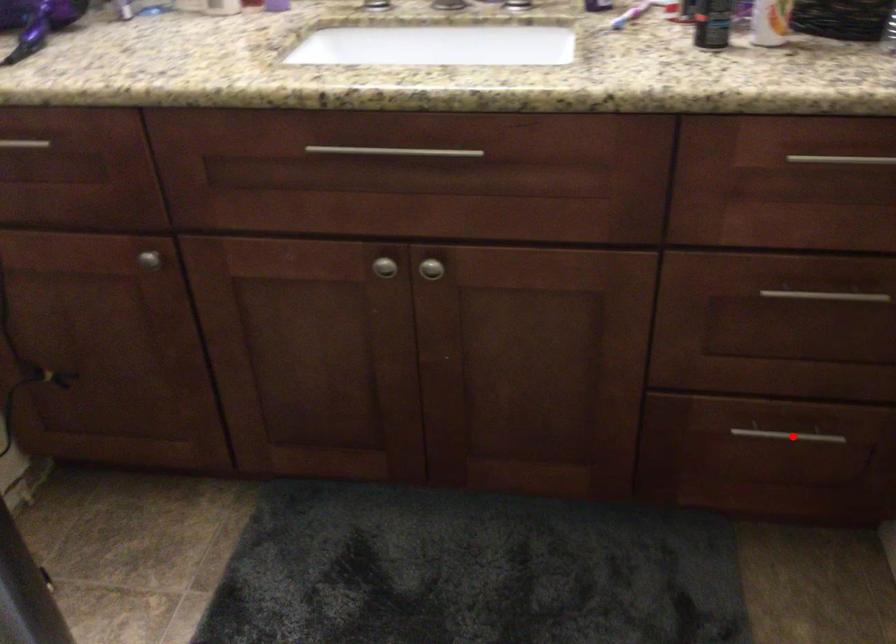
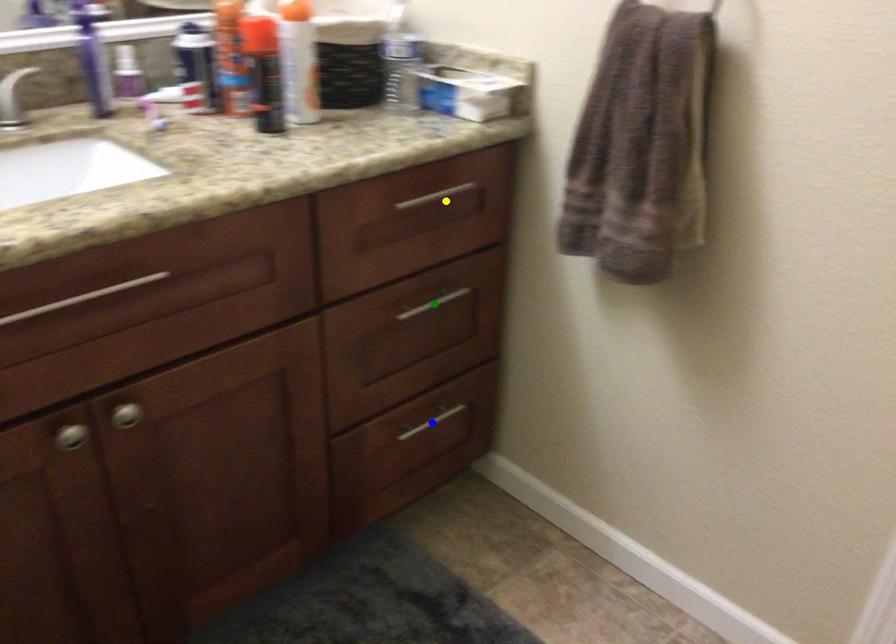
Question: I am providing you with two images of the same scene from different viewpoints. A red point is marked on the first image. You are given multiple points on the second image. Which spot in image 2 lines up with the point in image 1?

Choices:
 (A) blue point
 (B) yellow point
 (C) green point

Answer: (A)